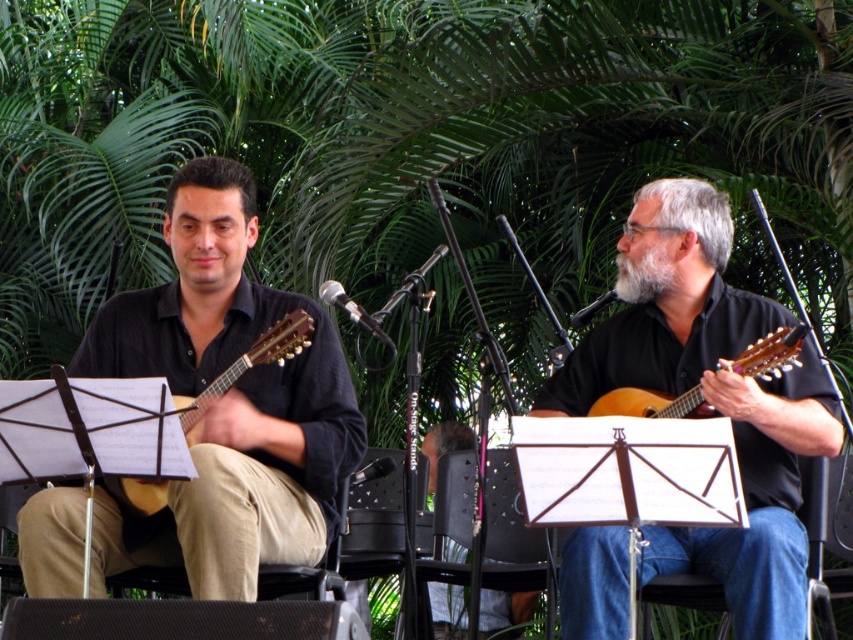
Question: Among these objects, which one is farthest from the camera?

Choices:
 (A) matte wood guitar at right
 (B) matte black guitar at left
 (C) wooden acoustic guitar at left
 (D) matte black guitar at center

Answer: (D)

Question: Can you confirm if matte black guitar at left is positioned to the left of wooden acoustic guitar at left?

Choices:
 (A) no
 (B) yes

Answer: (A)

Question: Is matte black guitar at center thinner than matte wood guitar at right?

Choices:
 (A) yes
 (B) no

Answer: (B)

Question: Which object appears farthest from the camera in this image?

Choices:
 (A) wooden acoustic guitar at left
 (B) matte wood guitar at right
 (C) matte black guitar at left
 (D) matte black guitar at center

Answer: (D)

Question: Does matte black guitar at center have a greater width compared to wooden acoustic guitar at left?

Choices:
 (A) no
 (B) yes

Answer: (B)

Question: Which object appears closest to the camera in this image?

Choices:
 (A) matte black guitar at center
 (B) matte black guitar at left
 (C) wooden acoustic guitar at left
 (D) matte wood guitar at right

Answer: (C)